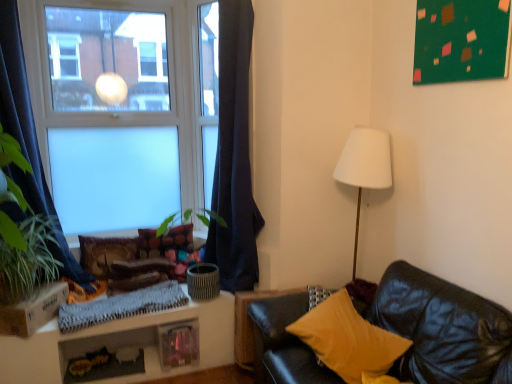
Question: From a real-world perspective, is dark blue fabric curtain at left, which is the 1th curtain from left to right, under yellow fabric pillow at lower right, which ranks as the third pillow in left-to-right order?

Choices:
 (A) yes
 (B) no

Answer: (B)

Question: Is dark blue fabric curtain at left, which is the 1th curtain from left to right, located outside yellow fabric pillow at lower right, which is counted as the 3th pillow, starting from the back?

Choices:
 (A) yes
 (B) no

Answer: (A)

Question: Does dark blue fabric curtain at left, the 2th curtain in the right-to-left sequence, have a lesser height compared to yellow fabric pillow at lower right, the 1th pillow in the front-to-back sequence?

Choices:
 (A) yes
 (B) no

Answer: (B)

Question: Is dark blue fabric curtain at left, the 2th curtain in the right-to-left sequence, next to yellow fabric pillow at lower right, the 1th pillow in the right-to-left sequence, and touching it?

Choices:
 (A) no
 (B) yes

Answer: (A)

Question: Would you say dark blue fabric curtain at left, which is the 1th curtain from left to right, is a long distance from yellow fabric pillow at lower right, the 1th pillow in the front-to-back sequence?

Choices:
 (A) no
 (B) yes

Answer: (B)

Question: Considering the relative positions of dark blue fabric curtain at left, the 2th curtain in the right-to-left sequence, and yellow fabric pillow at lower right, the 1th pillow in the front-to-back sequence, in the image provided, is dark blue fabric curtain at left, the 2th curtain in the right-to-left sequence, in front of yellow fabric pillow at lower right, the 1th pillow in the front-to-back sequence,?

Choices:
 (A) yes
 (B) no

Answer: (B)

Question: Considering the relative sizes of velvet textured pillow at center, marked as the 3th pillow in a front-to-back arrangement, and white knitted blanket at lower left in the image provided, is velvet textured pillow at center, marked as the 3th pillow in a front-to-back arrangement, smaller than white knitted blanket at lower left?

Choices:
 (A) no
 (B) yes

Answer: (B)

Question: From a real-world perspective, is velvet textured pillow at center, which is the 1th pillow from back to front, over white knitted blanket at lower left?

Choices:
 (A) no
 (B) yes

Answer: (B)

Question: Is the position of velvet textured pillow at center, marked as the 3th pillow in a front-to-back arrangement, more distant than that of white knitted blanket at lower left?

Choices:
 (A) no
 (B) yes

Answer: (B)

Question: From the image's perspective, is velvet textured pillow at center, the 2th pillow positioned from the right, above white knitted blanket at lower left?

Choices:
 (A) yes
 (B) no

Answer: (A)

Question: Is velvet textured pillow at center, which is the 1th pillow from back to front, next to white knitted blanket at lower left?

Choices:
 (A) no
 (B) yes

Answer: (A)

Question: Does velvet textured pillow at center, acting as the 2th pillow starting from the left, appear on the left side of white knitted blanket at lower left?

Choices:
 (A) yes
 (B) no

Answer: (B)

Question: Are dark blue fabric curtain at left, which is the 1th curtain from left to right, and green leafy plant at left far apart?

Choices:
 (A) no
 (B) yes

Answer: (A)